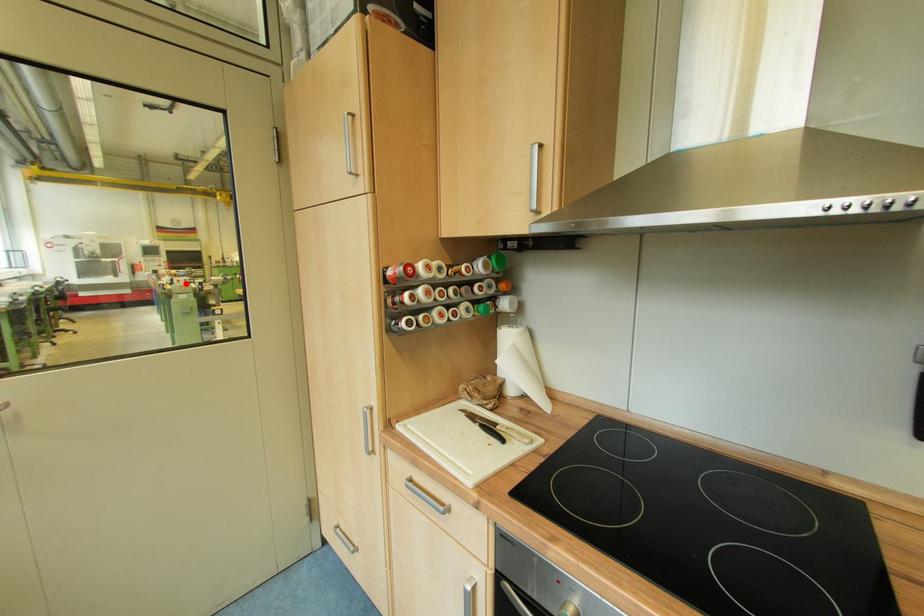
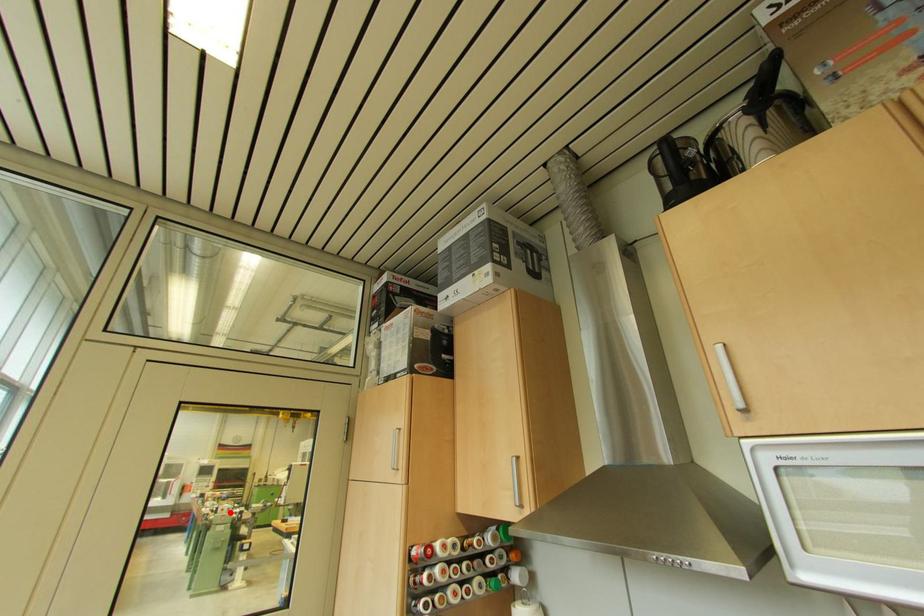
I am providing you with two images of the same scene from different viewpoints. A red point is marked on the first image and another point is marked on the second image. Is the red point in image1 aligned with the point shown in image2?

Yes